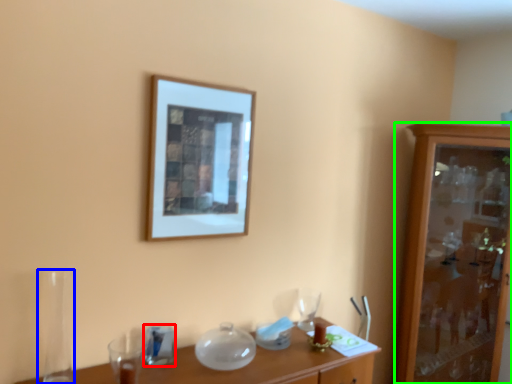
Question: Based on their relative distances, which object is farther from tableware (highlighted by a red box)? Choose from glass vase (highlighted by a blue box) and cabinetry (highlighted by a green box).

Choices:
 (A) glass vase
 (B) cabinetry

Answer: (B)